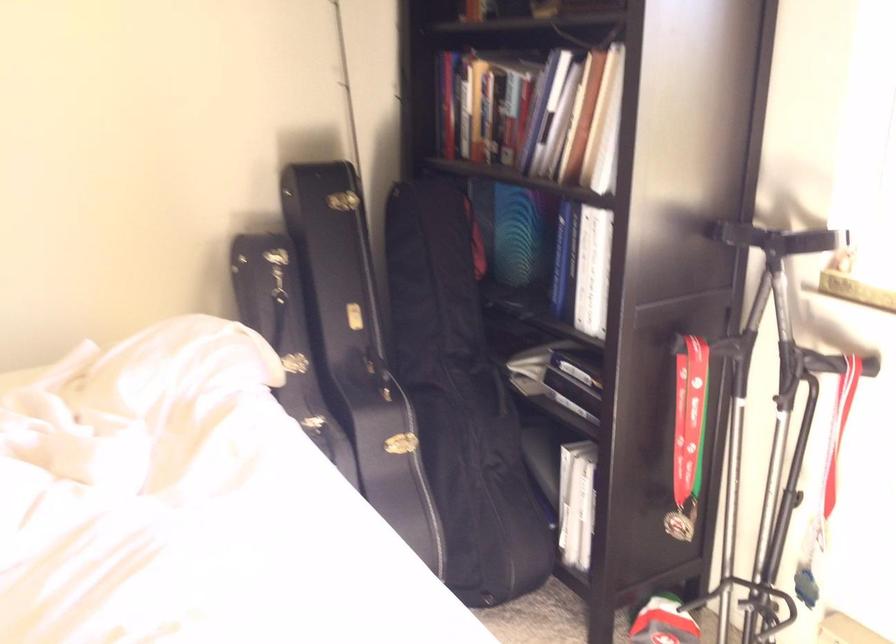
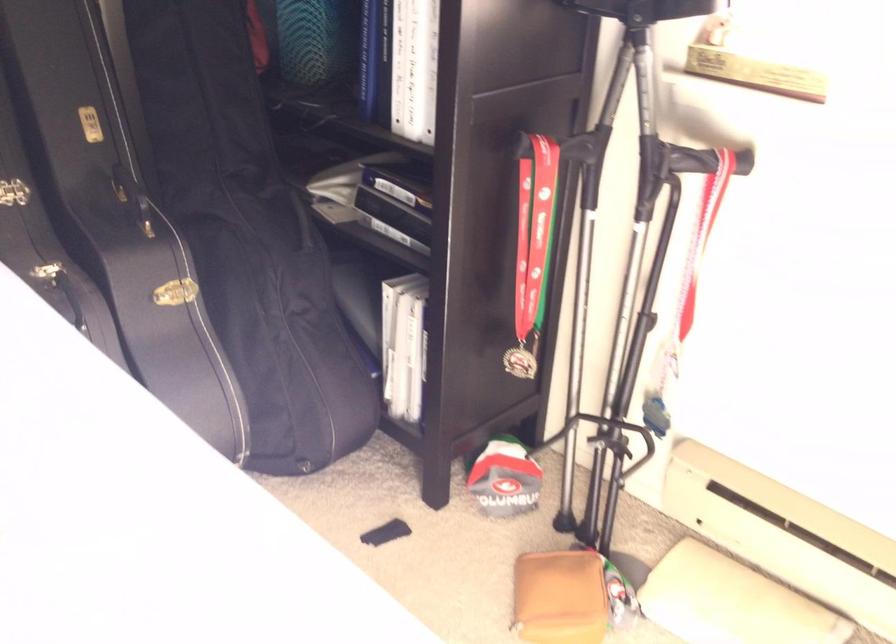
Question: The images are taken continuously from a first-person perspective. In which direction is your viewpoint rotating?

Choices:
 (A) Left
 (B) Right
 (C) Up
 (D) Down

Answer: (B)